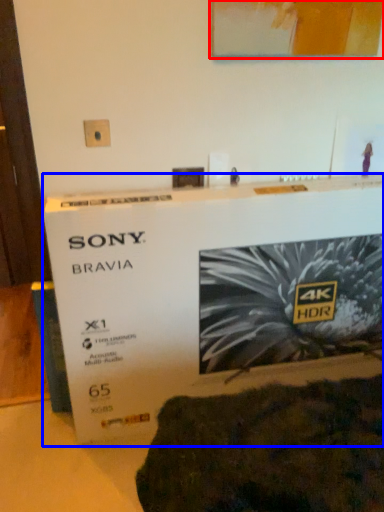
Question: Which point is closer to the camera, picture frame (highlighted by a red box) or poster (highlighted by a blue box)?

Choices:
 (A) picture frame
 (B) poster

Answer: (B)